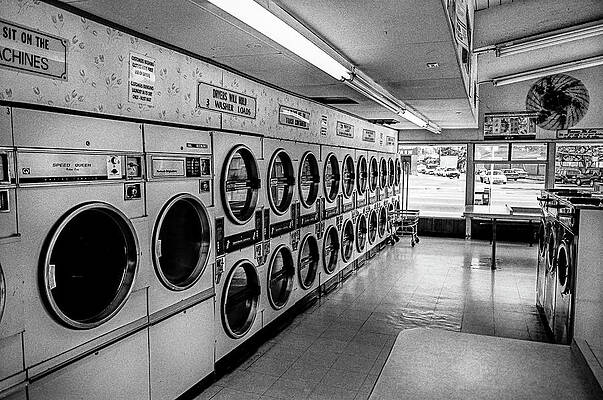
This screenshot has width=603, height=400. Find the location of `laundromat`. laundromat is located at coordinates (437, 244), (494, 243).